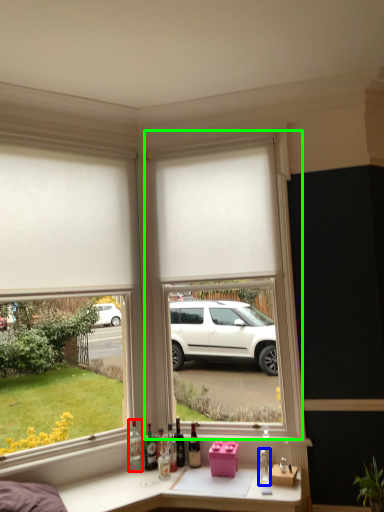
Question: Based on their relative distances, which object is nearer to bottle (highlighted by a red box)? Choose from bottle (highlighted by a blue box) and window frame (highlighted by a green box).

Choices:
 (A) bottle
 (B) window frame

Answer: (A)